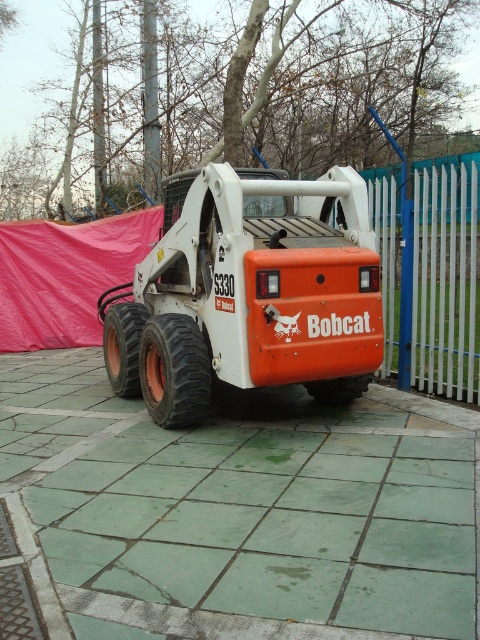
Between green tile pavement at center and orange matte bobcat at center, which one has more height?

Standing taller between the two is orange matte bobcat at center.

Does point (64, 362) lie behind point (360, 225)?

Yes, it is behind point (360, 225).

Identify the location of green tile pavement at center. The height and width of the screenshot is (640, 480). (236, 513).

Locate an element on the screen. green tile pavement at center is located at coordinates (236, 513).

Between orange matte bobcat at center and white metal fence at right, which one is positioned higher?

white metal fence at right is above.

Can you confirm if orange matte bobcat at center is shorter than white metal fence at right?

No, orange matte bobcat at center is not shorter than white metal fence at right.

Is point (215, 244) closer to viewer compared to point (456, 241)?

That is True.

What are the coordinates of `orange matte bobcat at center` in the screenshot? It's located at (248, 294).

How much distance is there between green tile pavement at center and white metal fence at right?

green tile pavement at center and white metal fence at right are 3.01 meters apart from each other.

Does green tile pavement at center have a lesser height compared to white metal fence at right?

Yes.

Between point (427, 465) and point (471, 317), which one is positioned in front?

Point (427, 465) is in front.

This screenshot has width=480, height=640. I want to click on green tile pavement at center, so click(236, 513).